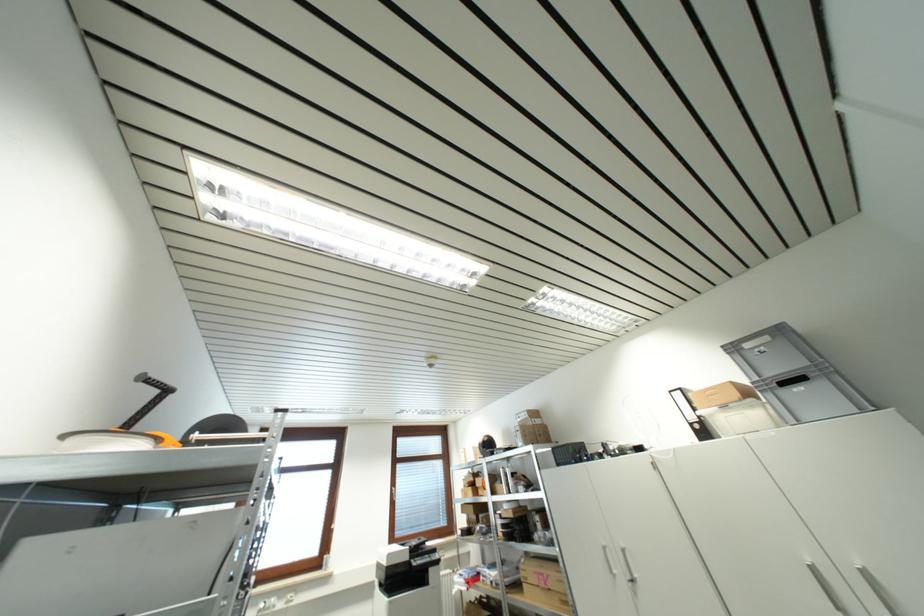
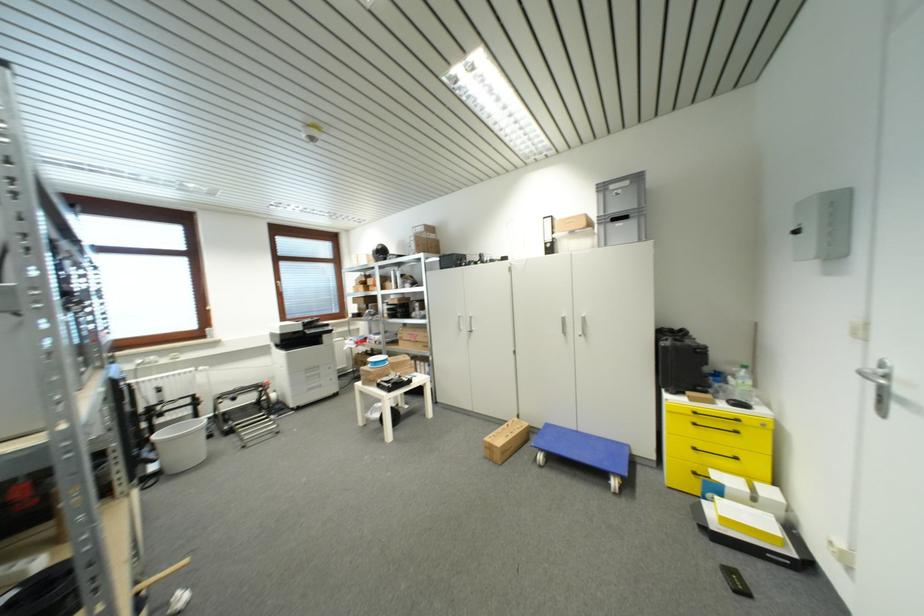
Where in the second image is the point corresponding to pixel 625 573 from the first image?

(468, 330)